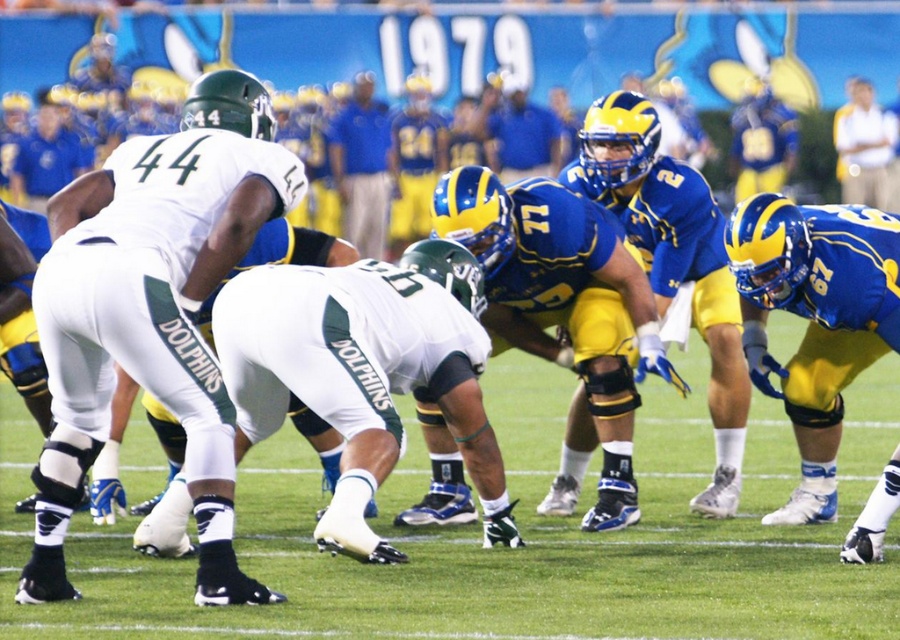
Question: Which point appears farthest from the camera in this image?

Choices:
 (A) click(x=846, y=196)
 (B) click(x=514, y=99)
 (C) click(x=361, y=77)

Answer: (B)

Question: Does white matte uniform at center appear on the left side of blue matte football player at center?

Choices:
 (A) yes
 (B) no

Answer: (A)

Question: Among these objects, which one is nearest to the camera?

Choices:
 (A) white matte uniform at center
 (B) blue/yellow uniform at center

Answer: (A)

Question: Estimate the real-world distances between objects in this image. Which object is closer to the blue/yellow uniform at center?

Choices:
 (A) blue fabric shirt at center
 (B) blue matte football player at center
 (C) light yellow shirt at upper right
 (D) blue jersey at center

Answer: (B)

Question: Does light yellow shirt at upper right have a greater width compared to blue jersey at center?

Choices:
 (A) yes
 (B) no

Answer: (B)

Question: Can you confirm if blue/yellow uniform at center is positioned to the right of blue jersey at center?

Choices:
 (A) yes
 (B) no

Answer: (A)